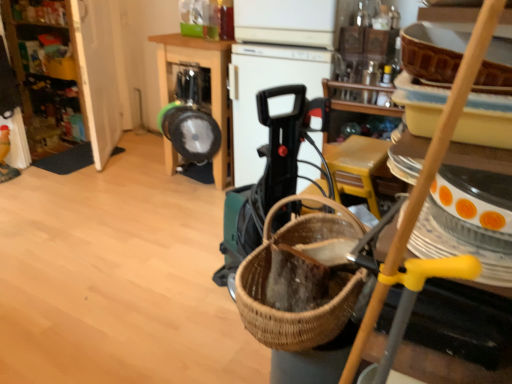
Question: Can you confirm if metallic silver frying pan at center is positioned to the left of wooden cabinet at left?

Choices:
 (A) yes
 (B) no

Answer: (B)

Question: Is metallic silver frying pan at center surrounding wooden cabinet at left?

Choices:
 (A) yes
 (B) no

Answer: (B)

Question: Is metallic silver frying pan at center not near wooden cabinet at left?

Choices:
 (A) yes
 (B) no

Answer: (A)

Question: Does metallic silver frying pan at center have a larger size compared to wooden cabinet at left?

Choices:
 (A) yes
 (B) no

Answer: (A)

Question: Is metallic silver frying pan at center aimed at wooden cabinet at left?

Choices:
 (A) no
 (B) yes

Answer: (A)

Question: Considering the relative sizes of metallic silver frying pan at center and wooden cabinet at left in the image provided, is metallic silver frying pan at center wider than wooden cabinet at left?

Choices:
 (A) yes
 (B) no

Answer: (A)

Question: Can you confirm if wooden cabinet at left is shorter than metallic silver frying pan at center?

Choices:
 (A) yes
 (B) no

Answer: (B)

Question: Does wooden cabinet at left have a smaller size compared to metallic silver frying pan at center?

Choices:
 (A) yes
 (B) no

Answer: (A)

Question: Can you confirm if wooden cabinet at left is positioned to the left of metallic silver frying pan at center?

Choices:
 (A) yes
 (B) no

Answer: (A)

Question: Is wooden cabinet at left oriented away from metallic silver frying pan at center?

Choices:
 (A) yes
 (B) no

Answer: (B)

Question: Considering the relative sizes of wooden cabinet at left and metallic silver frying pan at center in the image provided, is wooden cabinet at left bigger than metallic silver frying pan at center?

Choices:
 (A) yes
 (B) no

Answer: (B)

Question: Does wooden cabinet at left lie behind metallic silver frying pan at center?

Choices:
 (A) yes
 (B) no

Answer: (A)

Question: Does metallic silver blender at center, placed as the 2th appliance when sorted from right to left, lie in front of black plastic vacuum cleaner at center, the second appliance in the left-to-right sequence?

Choices:
 (A) no
 (B) yes

Answer: (A)